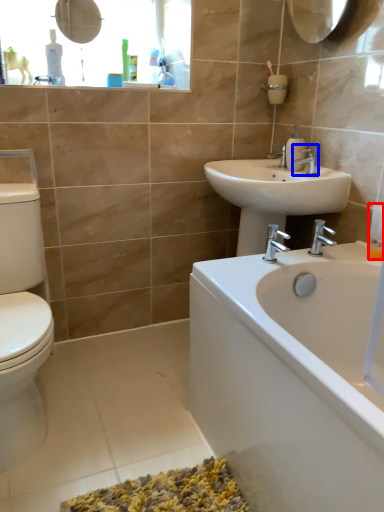
Question: Which point is closer to the camera, toiletry (highlighted by a red box) or tap (highlighted by a blue box)?

Choices:
 (A) toiletry
 (B) tap

Answer: (A)